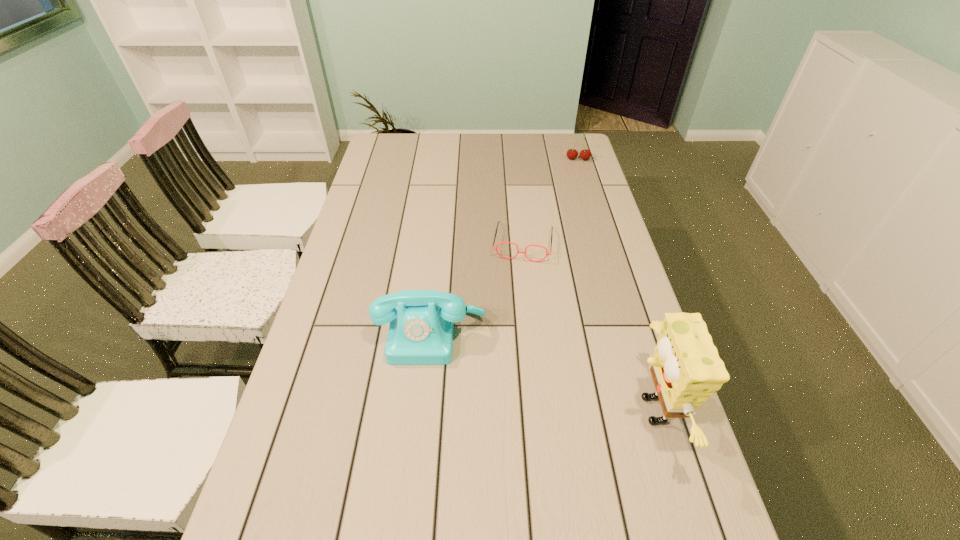
Where is `vacant space that's between the tallest object and the leftmost object`? The width and height of the screenshot is (960, 540). vacant space that's between the tallest object and the leftmost object is located at coordinates (540, 372).

You are a GUI agent. You are given a task and a screenshot of the screen. Output one action in this format:
    pyautogui.click(x=<x>, y=<y>)
    Task: Click on the free space between the tallest object and the cherry
    The image size is (960, 540).
    Given the screenshot: What is the action you would take?
    point(613,285)

The image size is (960, 540). I want to click on empty location between the leftmost object and the third tallest object, so click(505, 246).

In order to click on free area in between the shortest object and the leftmost object in this screenshot , I will do pyautogui.click(x=477, y=288).

The width and height of the screenshot is (960, 540). What are the coordinates of `free space between the farthest object and the sponge` in the screenshot? It's located at (613, 285).

Where is `vacant space in between the third nearest object and the leftmost object`? vacant space in between the third nearest object and the leftmost object is located at coordinates (477, 288).

Choose which object is the third nearest neighbor to the tallest object. Please provide its 2D coordinates. Your answer should be formatted as a tuple, i.e. [(x, y)], where the tuple contains the x and y coordinates of a point satisfying the conditions above.

[(585, 154)]

Point out which object is positioned as the third nearest to the second shortest object. Please provide its 2D coordinates. Your answer should be formatted as a tuple, i.e. [(x, y)], where the tuple contains the x and y coordinates of a point satisfying the conditions above.

[(686, 369)]

The height and width of the screenshot is (540, 960). What are the coordinates of `free location that satisfies the following two spatial constraints: 1. on the front side of the shortest object; 2. on the front-facing side of the tallest object` in the screenshot? It's located at (540, 410).

I want to click on vacant space that satisfies the following two spatial constraints: 1. on the dial of the sponge; 2. on the front-facing side of the leftmost object, so click(423, 410).